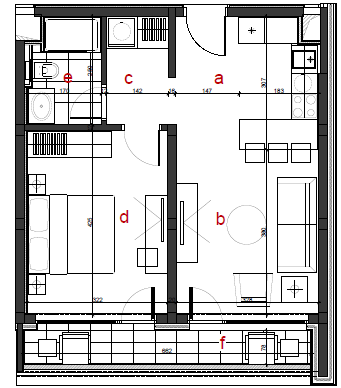
Find the location of a particular element. This screenshot has width=341, height=388. night stand is located at coordinates (36, 283), (36, 181).